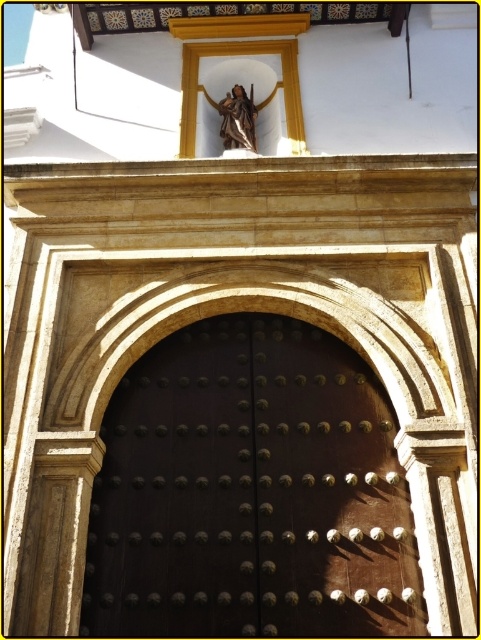
How much distance is there between dark polished wood door at center and matte bronze statue at upper center?

They are 14.87 feet apart.

Is dark polished wood door at center in front of matte bronze statue at upper center?

Answer: That is True.

Describe the element at coordinates (251, 492) in the screenshot. This screenshot has height=640, width=481. I see `dark polished wood door at center` at that location.

Find the location of `dark polished wood door at center`. dark polished wood door at center is located at coordinates (251, 492).